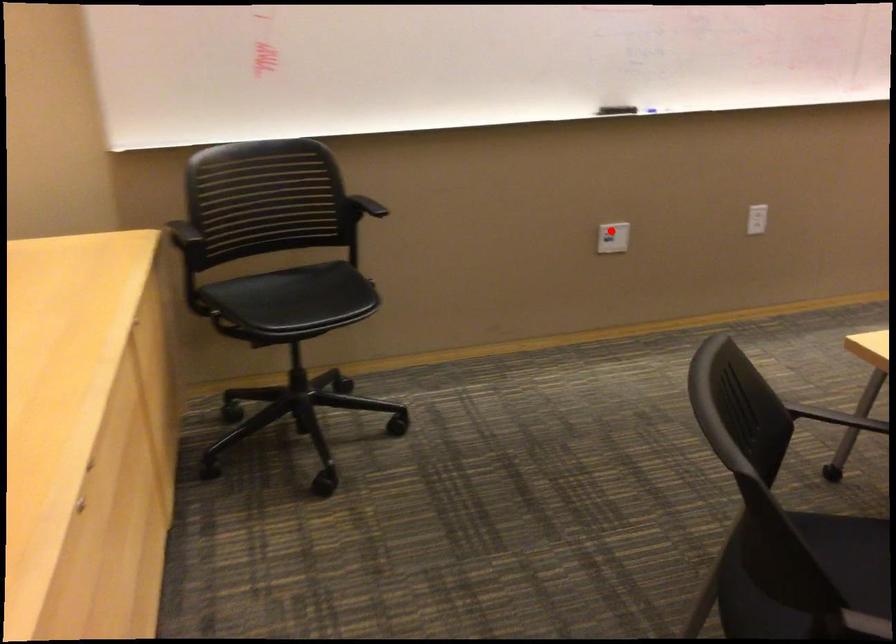
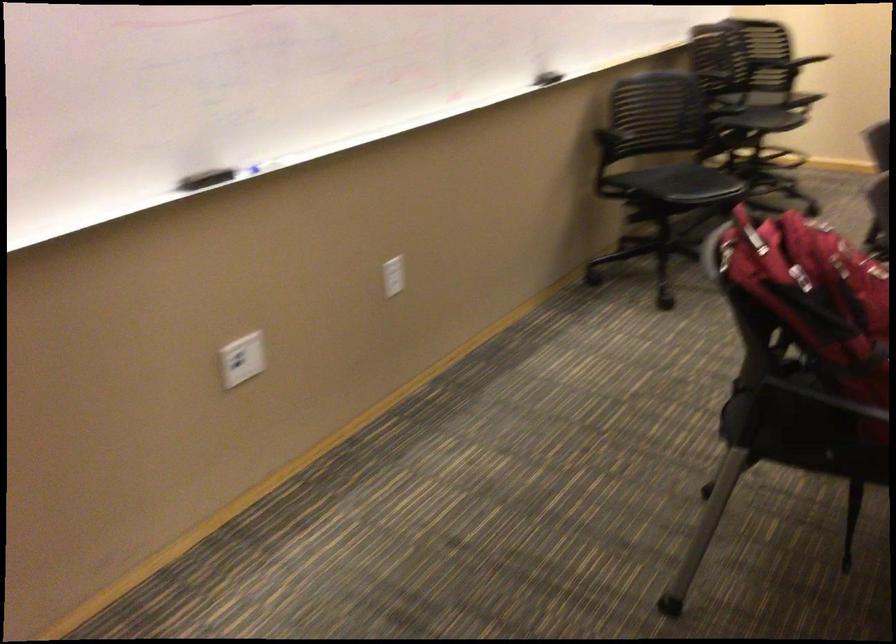
Question: I am providing you with two images of the same scene from different viewpoints. A red point is shown in image1. For the corresponding object point in image2, is it positioned nearer or farther from the camera?

Choices:
 (A) Nearer
 (B) Farther

Answer: (A)